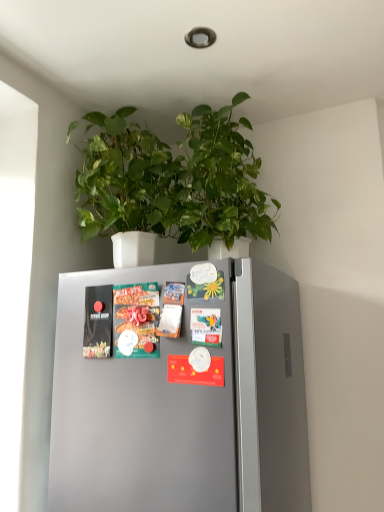
I want to click on matte plastic magazine at center, the 2th magazine from the left, so click(136, 319).

What do you see at coordinates (98, 322) in the screenshot? Image resolution: width=384 pixels, height=512 pixels. I see `matte black magazine at left, marked as the first magazine in a left-to-right arrangement` at bounding box center [98, 322].

Image resolution: width=384 pixels, height=512 pixels. I want to click on green glossy leaves at upper center, so click(x=173, y=179).

Is matte plastic magazine at center, the 2th magazine from the left, at the left side of green glossy leaves at upper center?

Yes.

Which is correct: matte plastic magazine at center, which is the first magazine in right-to-left order, is inside green glossy leaves at upper center, or outside of it?

matte plastic magazine at center, which is the first magazine in right-to-left order, is not enclosed by green glossy leaves at upper center.

Does point (148, 357) lie behind point (210, 216)?

No, (148, 357) is in front of (210, 216).

Between matte plastic magazine at center, the 2th magazine from the left, and matte black magazine at left, marked as the first magazine in a left-to-right arrangement, which one has less height?

Standing shorter between the two is matte black magazine at left, marked as the first magazine in a left-to-right arrangement.

Is matte plastic magazine at center, which is the first magazine in right-to-left order, next to matte black magazine at left, marked as the first magazine in a left-to-right arrangement, and touching it?

Yes.

From a real-world perspective, is matte plastic magazine at center, the 2th magazine from the left, positioned over matte black magazine at left, placed as the second magazine when sorted from right to left, based on gravity?

Incorrect, from a real-world perspective, matte plastic magazine at center, the 2th magazine from the left, is lower than matte black magazine at left, placed as the second magazine when sorted from right to left.

From the image's perspective, which object appears higher, green glossy leaves at upper center or matte black magazine at left, marked as the first magazine in a left-to-right arrangement?

green glossy leaves at upper center.

Looking at this image, does green glossy leaves at upper center appear on the right side of matte black magazine at left, marked as the first magazine in a left-to-right arrangement?

Yes, green glossy leaves at upper center is to the right of matte black magazine at left, marked as the first magazine in a left-to-right arrangement.

Considering the sizes of objects green glossy leaves at upper center and matte black magazine at left, placed as the second magazine when sorted from right to left, in the image provided, who is taller, green glossy leaves at upper center or matte black magazine at left, placed as the second magazine when sorted from right to left,?

With more height is green glossy leaves at upper center.

The height and width of the screenshot is (512, 384). In order to click on houseplant to the right of matte black magazine at left, marked as the first magazine in a left-to-right arrangement in this screenshot , I will do `click(173, 179)`.

Is matte black magazine at left, marked as the first magazine in a left-to-right arrangement, inside or outside of matte plastic magazine at center, the 2th magazine from the left?

matte black magazine at left, marked as the first magazine in a left-to-right arrangement, is spatially situated outside matte plastic magazine at center, the 2th magazine from the left.

Is the position of matte black magazine at left, placed as the second magazine when sorted from right to left, more distant than that of matte plastic magazine at center, the 2th magazine from the left?

Yes, it is.

From the image's perspective, is matte black magazine at left, placed as the second magazine when sorted from right to left, under matte plastic magazine at center, which is the first magazine in right-to-left order?

Yes, from the image's perspective, matte black magazine at left, placed as the second magazine when sorted from right to left, is below matte plastic magazine at center, which is the first magazine in right-to-left order.

Which of these two, matte black magazine at left, marked as the first magazine in a left-to-right arrangement, or matte plastic magazine at center, the 2th magazine from the left, stands taller?

With more height is matte plastic magazine at center, the 2th magazine from the left.

Between matte black magazine at left, marked as the first magazine in a left-to-right arrangement, and green glossy leaves at upper center, which one has smaller size?

Smaller between the two is matte black magazine at left, marked as the first magazine in a left-to-right arrangement.

Considering the relative positions of matte black magazine at left, placed as the second magazine when sorted from right to left, and green glossy leaves at upper center in the image provided, is matte black magazine at left, placed as the second magazine when sorted from right to left, behind green glossy leaves at upper center?

Yes, the depth of matte black magazine at left, placed as the second magazine when sorted from right to left, is greater than that of green glossy leaves at upper center.

From the image's perspective, which is above, matte black magazine at left, marked as the first magazine in a left-to-right arrangement, or green glossy leaves at upper center?

green glossy leaves at upper center, from the image's perspective.

Between matte black magazine at left, marked as the first magazine in a left-to-right arrangement, and green glossy leaves at upper center, which one has smaller width?

matte black magazine at left, marked as the first magazine in a left-to-right arrangement, is thinner.

Is green glossy leaves at upper center positioned with its back to matte plastic magazine at center, the 2th magazine from the left?

No, matte plastic magazine at center, the 2th magazine from the left, is not at the back of green glossy leaves at upper center.

From a real-world perspective, is green glossy leaves at upper center positioned above or below matte plastic magazine at center, the 2th magazine from the left?

green glossy leaves at upper center is above matte plastic magazine at center, the 2th magazine from the left.

Is the depth of green glossy leaves at upper center greater than that of matte plastic magazine at center, the 2th magazine from the left?

No.

Where is `houseplant above the matte plastic magazine at center, the 2th magazine from the left (from a real-world perspective)`? houseplant above the matte plastic magazine at center, the 2th magazine from the left (from a real-world perspective) is located at coordinates (173, 179).

Where is `magazine located on the left of matte plastic magazine at center, the 2th magazine from the left`? The image size is (384, 512). magazine located on the left of matte plastic magazine at center, the 2th magazine from the left is located at coordinates (98, 322).

From the image, which object appears to be farther from matte black magazine at left, marked as the first magazine in a left-to-right arrangement, matte plastic magazine at center, which is the first magazine in right-to-left order, or green glossy leaves at upper center?

green glossy leaves at upper center lies further to matte black magazine at left, marked as the first magazine in a left-to-right arrangement, than the other object.

Consider the image. From the image, which object appears to be nearer to matte plastic magazine at center, which is the first magazine in right-to-left order, matte black magazine at left, marked as the first magazine in a left-to-right arrangement, or green glossy leaves at upper center?

Among the two, matte black magazine at left, marked as the first magazine in a left-to-right arrangement, is located nearer to matte plastic magazine at center, which is the first magazine in right-to-left order.

Which object lies further to the anchor point green glossy leaves at upper center, matte plastic magazine at center, which is the first magazine in right-to-left order, or matte black magazine at left, placed as the second magazine when sorted from right to left?

The object further to green glossy leaves at upper center is matte black magazine at left, placed as the second magazine when sorted from right to left.

Which object lies further to the anchor point matte black magazine at left, placed as the second magazine when sorted from right to left, green glossy leaves at upper center or matte plastic magazine at center, the 2th magazine from the left?

green glossy leaves at upper center.

When comparing their distances from matte plastic magazine at center, the 2th magazine from the left, does green glossy leaves at upper center or matte black magazine at left, marked as the first magazine in a left-to-right arrangement, seem further?

green glossy leaves at upper center is further to matte plastic magazine at center, the 2th magazine from the left.

Based on their spatial positions, is matte black magazine at left, marked as the first magazine in a left-to-right arrangement, or matte plastic magazine at center, which is the first magazine in right-to-left order, further from green glossy leaves at upper center?

The object further to green glossy leaves at upper center is matte black magazine at left, marked as the first magazine in a left-to-right arrangement.

Identify the location of magazine between green glossy leaves at upper center and matte black magazine at left, marked as the first magazine in a left-to-right arrangement, from top to bottom. This screenshot has height=512, width=384. tap(136, 319).